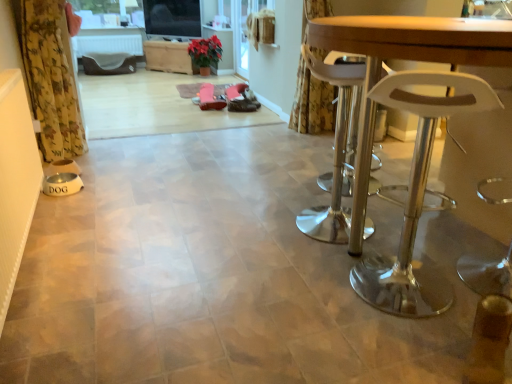
Locate an element on the screen. The image size is (512, 384). vacant space behind clear plastic stool at right is located at coordinates click(381, 244).